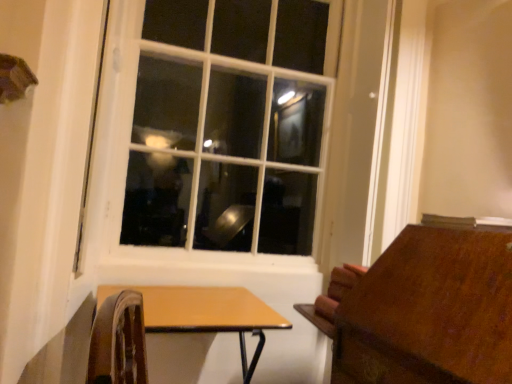
The width and height of the screenshot is (512, 384). What do you see at coordinates (205, 313) in the screenshot?
I see `wooden table at center` at bounding box center [205, 313].

Locate an element on the screen. wooden table at center is located at coordinates (205, 313).

What is the approximate height of wooden table at center?

wooden table at center is 16.60 inches in height.

Identify the location of wooden table at center. This screenshot has height=384, width=512. (205, 313).